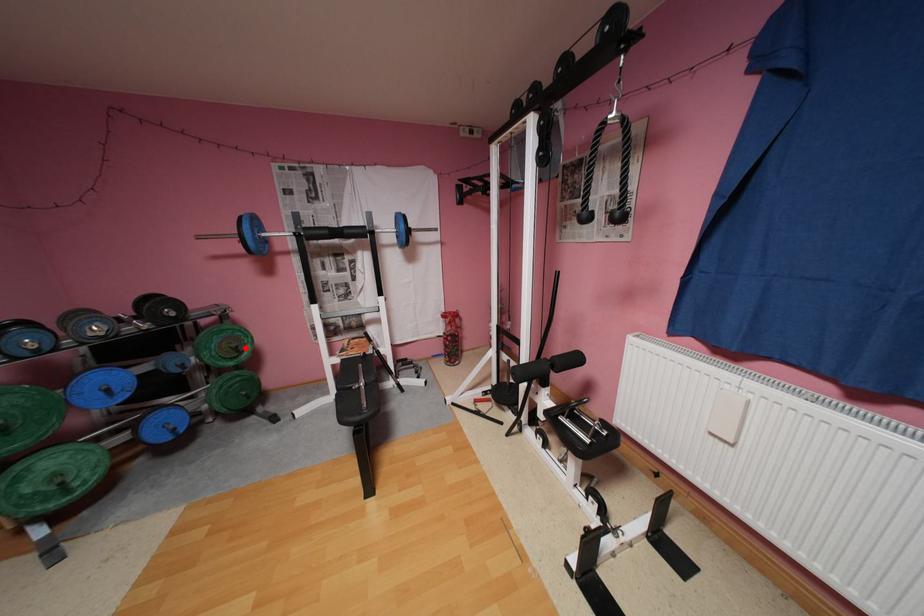
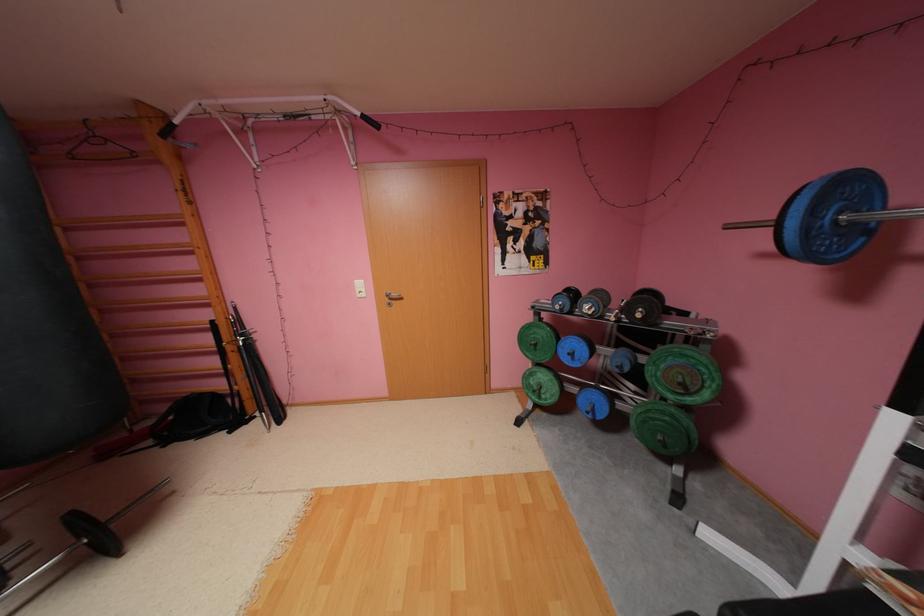
Find the pixel in the second image that matches the highlighted location in the first image.

(690, 384)